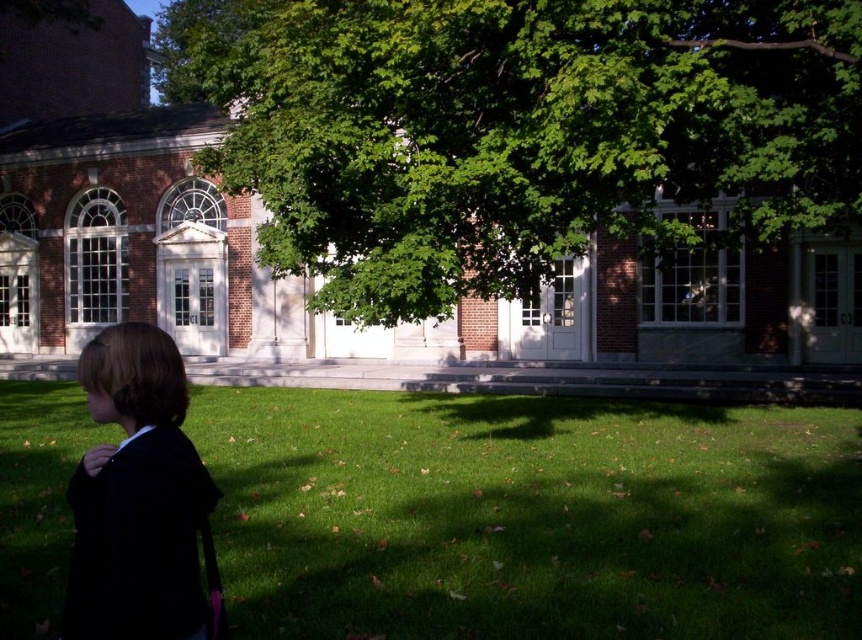
You are a photographer trying to capture the green grass at lower left and the green leafy tree at center in the same frame. Based on their positions, which object is closer to the right edge of the image?

The green grass at lower left is to the right of the green leafy tree at center, so the green grass at lower left is closer to the right edge of the image.

You are a gardener who needs to mow the lawn. You see the green grass at lower left and the green leafy tree at center. Which area requires mowing, and why?

The green grass at lower left requires mowing because it is shorter than the green leafy tree at center, but grass typically needs regular mowing to maintain its health and appearance. The tree does not need mowing as it is a tree.